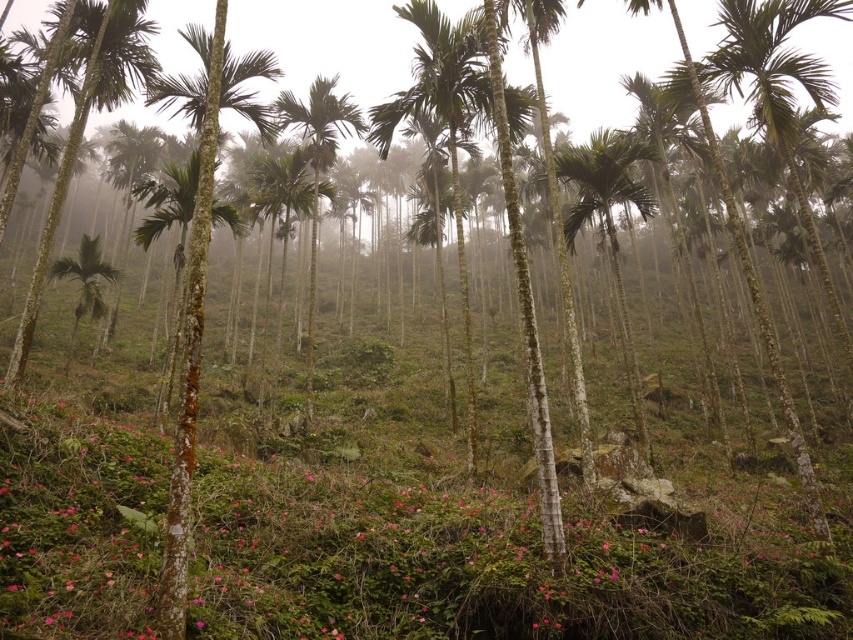
Can you confirm if green leafy palm tree at center is thinner than green smooth palm tree at center?

Indeed, green leafy palm tree at center has a lesser width compared to green smooth palm tree at center.

In the scene shown: Does green leafy palm tree at center have a greater width compared to green smooth palm tree at center?

In fact, green leafy palm tree at center might be narrower than green smooth palm tree at center.

Image resolution: width=853 pixels, height=640 pixels. Describe the element at coordinates (608, 220) in the screenshot. I see `green leafy palm tree at center` at that location.

Where is `green leafy palm tree at center`? This screenshot has height=640, width=853. green leafy palm tree at center is located at coordinates (608, 220).

Between point (16, 376) and point (97, 288), which one is positioned behind?

Positioned behind is point (97, 288).

Is green smooth palm tree at left above green glossy palm tree at left?

Yes.

What are the coordinates of `green smooth palm tree at left` in the screenshot? It's located at (84, 125).

Consider the image. Who is taller, green leafy palm tree at center or green glossy palm tree at left?

green leafy palm tree at center

Is point (598, 205) less distant than point (96, 300)?

That is True.

Is point (619, 330) farther from camera compared to point (88, 308)?

Yes, it is behind point (88, 308).

I want to click on green leafy palm tree at center, so click(608, 220).